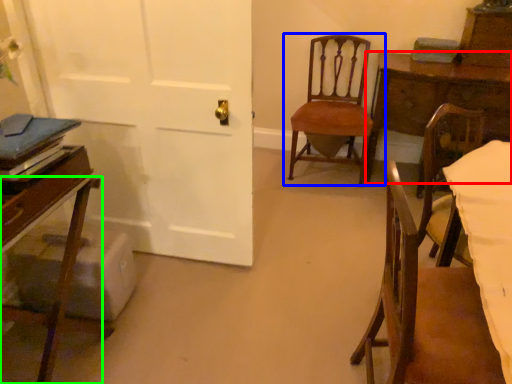
Question: Which object is the farthest from table (highlighted by a red box)? Choose among these: chair (highlighted by a blue box) or chair (highlighted by a green box).

Choices:
 (A) chair
 (B) chair

Answer: (B)